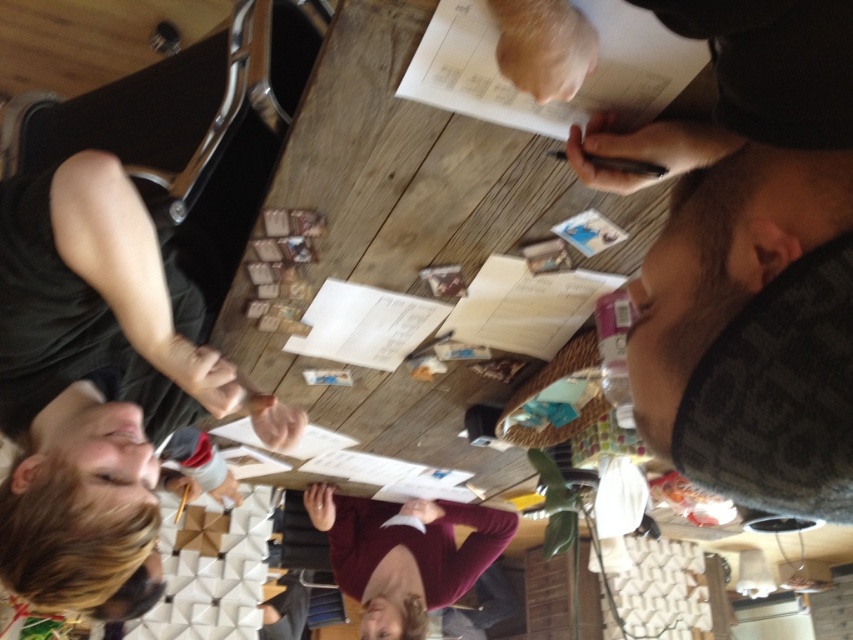
You are taking a photo of the scene and want to focus on both the point at point (722, 349) and the point at point (396, 547). Which point should you focus on first to ensure both are in sharp focus?

You should focus on point (722, 349) first because it is closer to the camera than point (396, 547), ensuring that both points will be in focus when using the correct focus distance.

You are organizing a meeting and need to place a name tag on the table. The name tag is 10 cm in height. The white paper at upper center and the maroon sweater at center are on the table. Can you place the name tag on either of these items without it being taller than them?

The white paper at upper center is shorter than the maroon sweater at center. Since the name tag is 10 cm tall, it can be placed on the maroon sweater at center because it is taller than the name tag. However, placing it on the white paper at upper center may not be suitable as the paper is shorter than the name tag.

You are a photographer standing in front of the table. You want to take a photo of the maroon sweater at center without the dark gray textured shirt at upper right blocking the view. Is this possible?

The dark gray textured shirt at upper right is closer to the viewer than the maroon sweater at center, so it may block the view of the maroon sweater at center. To take a photo of the maroon sweater at center without the dark gray textured shirt at upper right blocking the view, you would need to adjust your angle or move the objects to ensure the maroon sweater at center is visible.